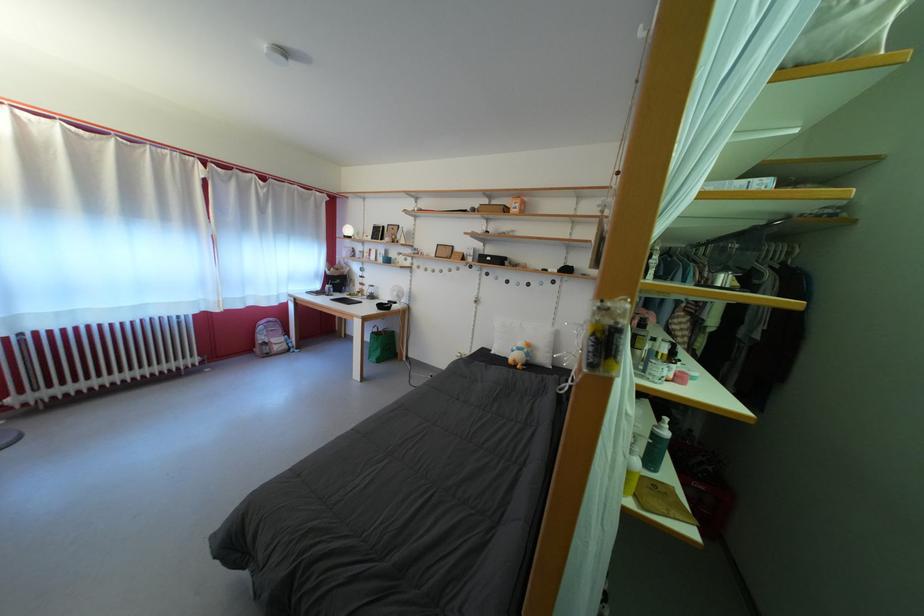
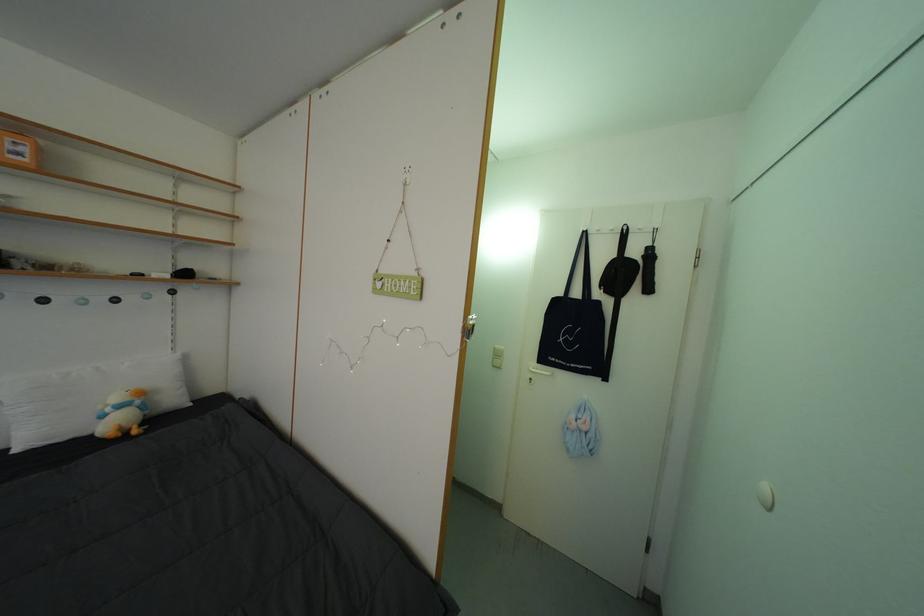
Locate, in the second image, the point that corresponds to pixel 524 214 in the first image.

(27, 160)